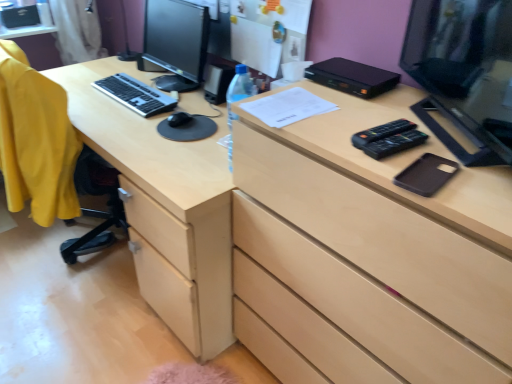
The image size is (512, 384). What are the coordinates of `vacant area that lies between black plastic printer at upper center and white paper at center` in the screenshot? It's located at (317, 92).